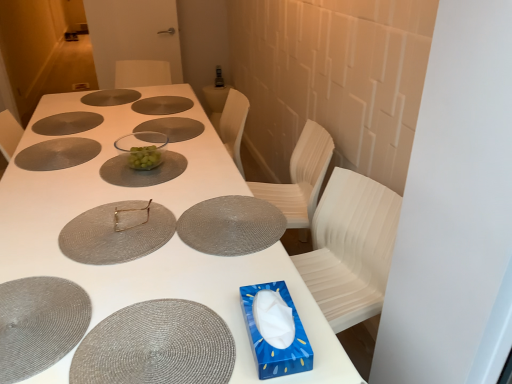
The image size is (512, 384). Find the location of `free point to the left of transparent glass bowl at center`. free point to the left of transparent glass bowl at center is located at coordinates (94, 160).